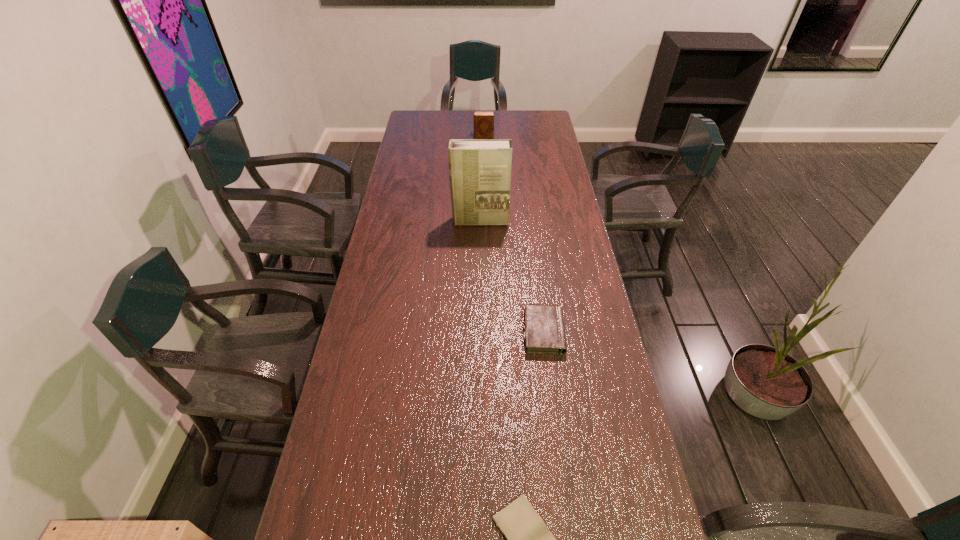
Find the location of `the third nearest object`. the third nearest object is located at coordinates (479, 169).

This screenshot has height=540, width=960. Find the location of `the tallest object`. the tallest object is located at coordinates (479, 169).

The image size is (960, 540). Identify the location of the farthest object. (483, 120).

What are the coordinates of `the tallest diary` in the screenshot? It's located at (483, 120).

You are a GUI agent. You are given a task and a screenshot of the screen. Output one action in this format:
    pyautogui.click(x=<x>, y=<y>)
    Task: Click on the second shortest object
    The height and width of the screenshot is (540, 960).
    Given the screenshot: What is the action you would take?
    pyautogui.click(x=544, y=333)

Locate an element on the screen. The image size is (960, 540). the second nearest diary is located at coordinates 544,333.

Find the location of a particular element. The height and width of the screenshot is (540, 960). vacant space positioned on the cover of the second farthest object is located at coordinates point(480,285).

The image size is (960, 540). Find the location of `vacant space located on the spine side of the farthest diary`. vacant space located on the spine side of the farthest diary is located at coordinates (408, 137).

The image size is (960, 540). I want to click on vacant space located 0.050m on the spine side of the farthest diary, so 464,137.

This screenshot has width=960, height=540. Identify the location of vacant position located on the spine side of the farthest diary. (430, 137).